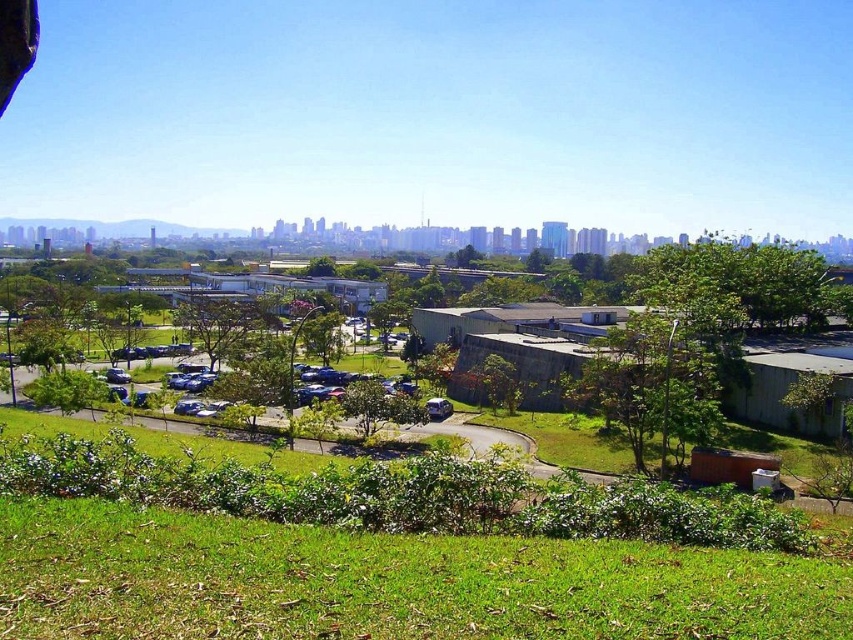
Based on the photo, how much distance is there between green grassy park at lower left and green leafy tree at center?

green grassy park at lower left and green leafy tree at center are 311.81 meters apart.

Which of these two, green grassy park at lower left or green leafy tree at center, stands shorter?

With less height is green grassy park at lower left.

Is point (824, 612) farther from viewer compared to point (450, 252)?

No, (824, 612) is in front of (450, 252).

Locate an element on the screen. The width and height of the screenshot is (853, 640). green grassy park at lower left is located at coordinates (384, 552).